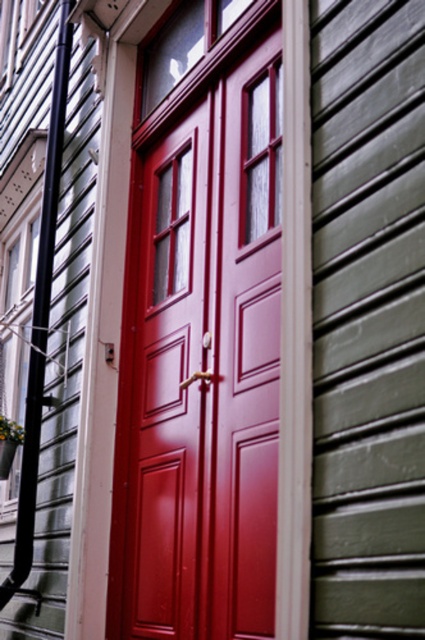
Question: Based on their relative distances, which object is farther from the black plastic pipe at left?

Choices:
 (A) green painted wood siding at right
 (B) glossy wood door at center

Answer: (A)

Question: Estimate the real-world distances between objects in this image. Which object is closer to the green painted wood siding at right?

Choices:
 (A) glossy wood door at center
 (B) black plastic pipe at left

Answer: (A)

Question: From the image, what is the correct spatial relationship of glossy wood door at center in relation to green painted wood siding at right?

Choices:
 (A) below
 (B) above

Answer: (B)

Question: Can you confirm if glossy wood door at center is wider than black plastic pipe at left?

Choices:
 (A) no
 (B) yes

Answer: (B)

Question: Which point is farther to the camera?

Choices:
 (A) (325, 416)
 (B) (150, 186)
 (C) (33, 518)

Answer: (C)

Question: Can you confirm if green painted wood siding at right is positioned to the left of black plastic pipe at left?

Choices:
 (A) no
 (B) yes

Answer: (A)